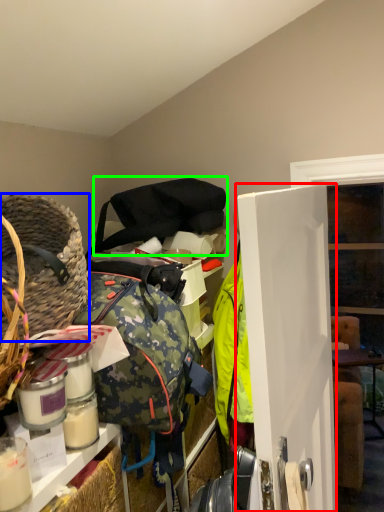
Question: Based on their relative distances, which object is nearer to door (highlighted by a red box)? Choose from basket (highlighted by a blue box) and shoulder bag (highlighted by a green box).

Choices:
 (A) basket
 (B) shoulder bag

Answer: (A)